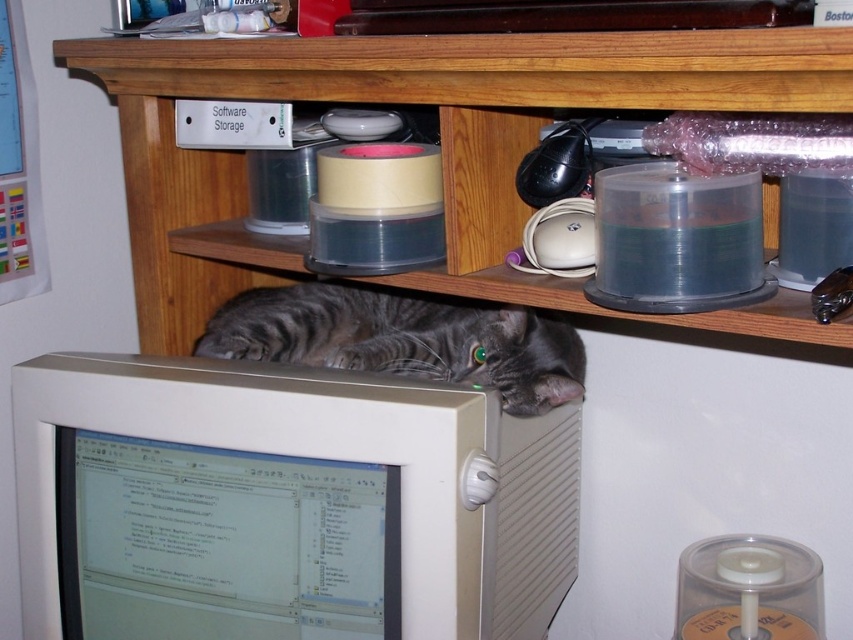
Can you confirm if beige plastic monitor at center is taller than wooden shelf at center?

In fact, beige plastic monitor at center may be shorter than wooden shelf at center.

Between beige plastic monitor at center and wooden shelf at center, which one has less height?

beige plastic monitor at center is shorter.

Is point (144, 433) positioned after point (666, 67)?

Yes, point (144, 433) is behind point (666, 67).

You are a GUI agent. You are given a task and a screenshot of the screen. Output one action in this format:
    pyautogui.click(x=<x>, y=<y>)
    Task: Click on the beige plastic monitor at center
    The height and width of the screenshot is (640, 853).
    Given the screenshot: What is the action you would take?
    pyautogui.click(x=283, y=502)

At what (x,y) coordinates should I click in order to perform the action: click on wooden shelf at center. Please return your answer as a coordinate pair (x, y). Image resolution: width=853 pixels, height=640 pixels. Looking at the image, I should click on (440, 144).

Is wooden shelf at center below gray striped fur at center?

Actually, wooden shelf at center is above gray striped fur at center.

Which is in front, point (581, 45) or point (289, 308)?

Point (581, 45) is more forward.

The height and width of the screenshot is (640, 853). I want to click on wooden shelf at center, so click(x=440, y=144).

Which of these two, beige plastic monitor at center or gray striped fur at center, stands taller?

Standing taller between the two is beige plastic monitor at center.

Is beige plastic monitor at center wider than gray striped fur at center?

Yes.

Where is `beige plastic monitor at center`? beige plastic monitor at center is located at coordinates (283, 502).

Find the location of a particular element. The height and width of the screenshot is (640, 853). beige plastic monitor at center is located at coordinates (283, 502).